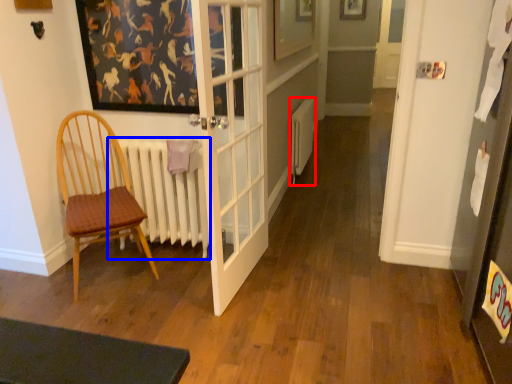
Question: Among these objects, which one is nearest to the camera, heater (highlighted by a red box) or radiator (highlighted by a blue box)?

Choices:
 (A) heater
 (B) radiator

Answer: (B)